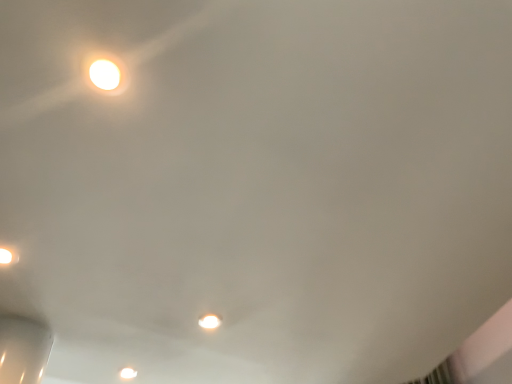
Measure the distance between matte white lamp at lower center and camera.

matte white lamp at lower center and camera are 1.64 meters apart from each other.

What do you see at coordinates (209, 321) in the screenshot? I see `matte white lamp at lower center` at bounding box center [209, 321].

The width and height of the screenshot is (512, 384). Identify the location of matte white lamp at lower center. (209, 321).

Identify the location of matte white lamp at lower center. (209, 321).